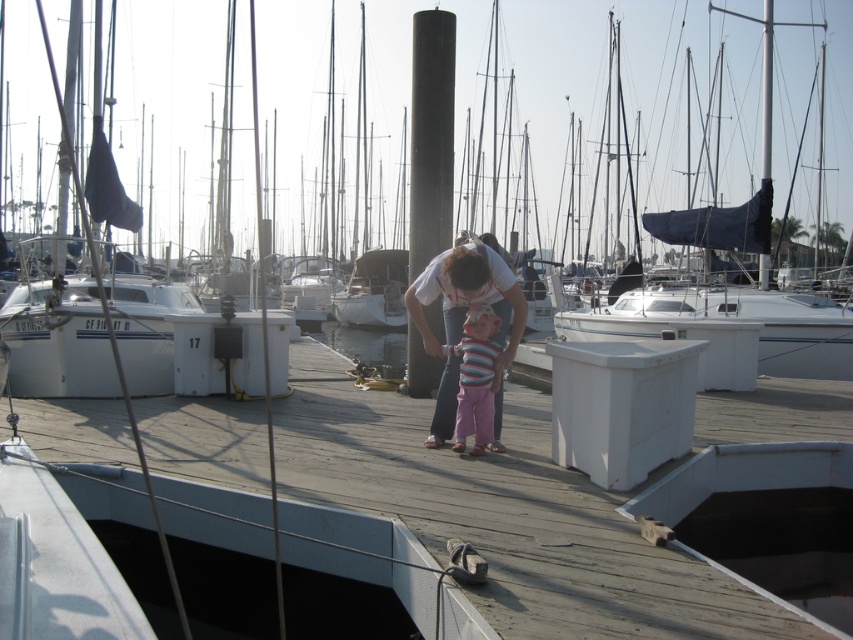
Between point (463, 284) and point (485, 365), which one is positioned behind?

Positioned behind is point (485, 365).

Can you confirm if white cotton shirt at center is shorter than striped fabric at center?

No, white cotton shirt at center is not shorter than striped fabric at center.

Does point (508, 364) come behind point (474, 385)?

No, it is not.

You are a GUI agent. You are given a task and a screenshot of the screen. Output one action in this format:
    pyautogui.click(x=<x>, y=<y>)
    Task: Click on the white cotton shirt at center
    The width and height of the screenshot is (853, 640).
    Given the screenshot: What is the action you would take?
    pyautogui.click(x=467, y=296)